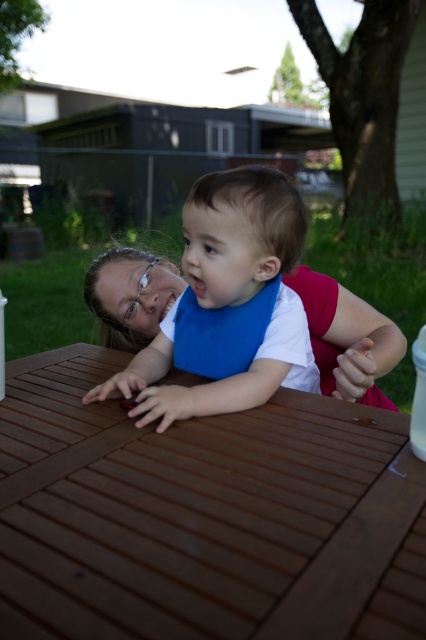
You are a parent trying to place a blue fabric bib at center on the brown wooden table at center. Will the bib fit on the table?

The brown wooden table at center is not as tall as the blue fabric bib at center, so the bib will not fit on the table because it is taller than the table.

You are standing in the backyard and want to pick up an object that is closer to you. Which point should you go to, point (290, 621) or point (138, 365)?

Point (290, 621) is closer to the camera, so you should go to point (290, 621) to pick up the object closer to you.